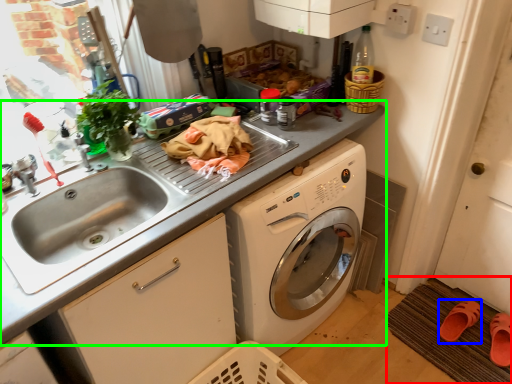
Question: Which object is positioned closest to doormat (highlighted by a red box)? Select from shoe (highlighted by a blue box) and countertop (highlighted by a green box).

Choices:
 (A) shoe
 (B) countertop

Answer: (A)